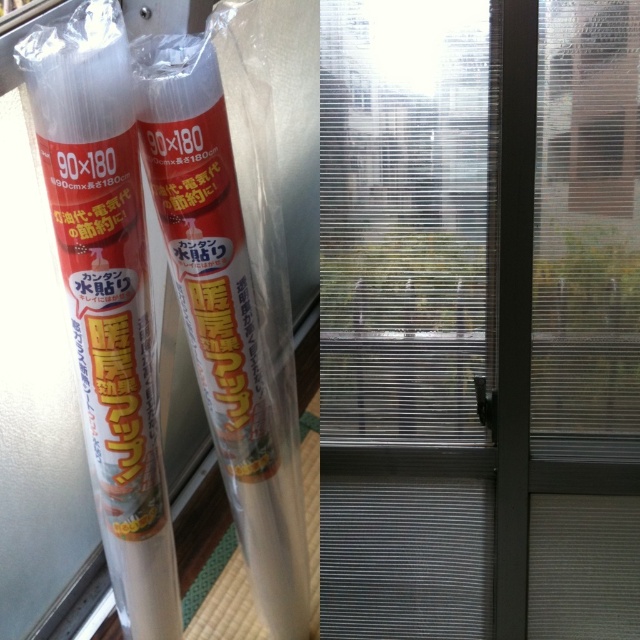
Question: Where is transparent frosted glass door at center located in relation to transparent plastic tube at center in the image?

Choices:
 (A) right
 (B) left

Answer: (A)

Question: Which point is farther from the camera taking this photo?

Choices:
 (A) (70, 305)
 (B) (339, 396)

Answer: (B)

Question: Among these points, which one is nearest to the camera?

Choices:
 (A) (122, 356)
 (B) (358, 401)
 (C) (170, 227)

Answer: (A)

Question: Estimate the real-world distances between objects in this image. Which object is closer to the transparent frosted glass door at center?

Choices:
 (A) transparent plastic tube at left
 (B) transparent plastic tube at center

Answer: (B)

Question: Is transparent frosted glass door at center thinner than transparent plastic tube at left?

Choices:
 (A) no
 (B) yes

Answer: (A)

Question: Is transparent plastic tube at center thinner than transparent plastic tube at left?

Choices:
 (A) yes
 (B) no

Answer: (B)